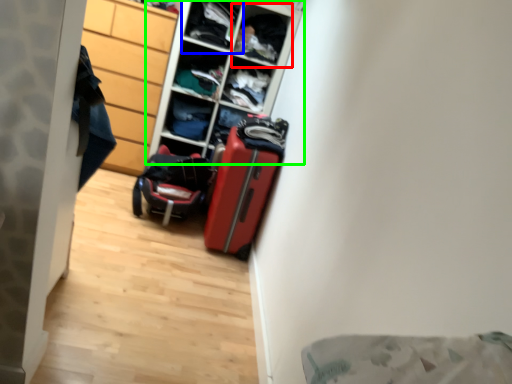
Question: Based on their relative distances, which object is farther from shelf (highlighted by a red box)? Choose from shelf (highlighted by a blue box) and shelf (highlighted by a green box).

Choices:
 (A) shelf
 (B) shelf

Answer: (B)